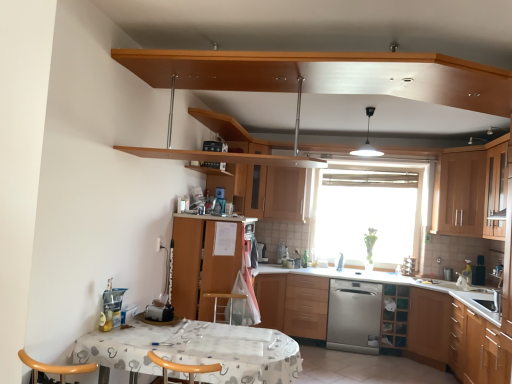
Find the location of a particular element. The height and width of the screenshot is (384, 512). wooden cabinet at center, which appears as the 1th cabinetry when viewed from the left is located at coordinates (x=202, y=264).

Describe the element at coordinates (495, 191) in the screenshot. The width and height of the screenshot is (512, 384). I see `wooden cabinet at upper right, the 1th cabinetry positioned from the right` at that location.

Measure the distance between wooden cabinet at upper right, which is counted as the 6th cabinetry, starting from the left, and camera.

wooden cabinet at upper right, which is counted as the 6th cabinetry, starting from the left, and camera are 4.13 meters apart from each other.

Describe the element at coordinates (354, 316) in the screenshot. Image resolution: width=512 pixels, height=384 pixels. I see `satin silver dishwasher at center` at that location.

What is the approximate height of transparent glass window at center?

4.64 feet.

This screenshot has height=384, width=512. In order to click on white fabric-covered table at lower center in this screenshot , I will do `click(197, 350)`.

This screenshot has height=384, width=512. What do you see at coordinates (275, 192) in the screenshot? I see `wooden cabinet at center, the 5th cabinetry in the right-to-left sequence` at bounding box center [275, 192].

The height and width of the screenshot is (384, 512). In order to click on wooden cabinet at center, which appears as the 1th cabinetry when viewed from the left in this screenshot , I will do `click(202, 264)`.

From a real-world perspective, which is physically below, wooden cabinet at right, the 5th cabinetry from the left, or satin silver dishwasher at center?

satin silver dishwasher at center.

Considering their positions, is wooden cabinet at right, the 5th cabinetry from the left, located in front of or behind satin silver dishwasher at center?

wooden cabinet at right, the 5th cabinetry from the left, is positioned closer to the viewer than satin silver dishwasher at center.

Are wooden cabinet at right, which ranks as the second cabinetry in right-to-left order, and satin silver dishwasher at center located far from each other?

wooden cabinet at right, which ranks as the second cabinetry in right-to-left order, is far away from satin silver dishwasher at center.

At what (x,y) coordinates should I click in order to perform the action: click on table that appears in front of the wooden cabinet at upper right, which is counted as the 6th cabinetry, starting from the left. Please return your answer as a coordinate pair (x, y). This screenshot has height=384, width=512. Looking at the image, I should click on (197, 350).

Is white fabric-covered table at lower center taller than wooden cabinet at upper right, the 1th cabinetry positioned from the right?

In fact, white fabric-covered table at lower center may be shorter than wooden cabinet at upper right, the 1th cabinetry positioned from the right.

Which object is positioned more to the right, white fabric-covered table at lower center or wooden cabinet at upper right, the 1th cabinetry positioned from the right?

From the viewer's perspective, wooden cabinet at upper right, the 1th cabinetry positioned from the right, appears more on the right side.

Is white fabric-covered table at lower center further to camera compared to wooden cabinet at upper right, which is counted as the 6th cabinetry, starting from the left?

No, it is not.

Is wooden cabinet at upper right, the 1th cabinetry positioned from the right, next to wooden cabinet at right, the 4th cabinetry positioned from the left?

wooden cabinet at upper right, the 1th cabinetry positioned from the right, and wooden cabinet at right, the 4th cabinetry positioned from the left, are not in contact.

Is wooden cabinet at upper right, the 1th cabinetry positioned from the right, situated inside wooden cabinet at right, arranged as the 3th cabinetry when viewed from the right, or outside?

wooden cabinet at upper right, the 1th cabinetry positioned from the right, cannot be found inside wooden cabinet at right, arranged as the 3th cabinetry when viewed from the right.

Based on the photo, which object is positioned more to the left, wooden cabinet at upper right, which is counted as the 6th cabinetry, starting from the left, or wooden cabinet at right, the 4th cabinetry positioned from the left?

wooden cabinet at right, the 4th cabinetry positioned from the left, is more to the left.

Choose the correct answer: Is wooden cabinet at right, the 4th cabinetry positioned from the left, inside wooden cabinet at center, which appears as the 1th cabinetry when viewed from the left, or outside it?

wooden cabinet at right, the 4th cabinetry positioned from the left, is not enclosed by wooden cabinet at center, which appears as the 1th cabinetry when viewed from the left.

How many degrees apart are the facing directions of wooden cabinet at right, arranged as the 3th cabinetry when viewed from the right, and wooden cabinet at center, arranged as the 6th cabinetry when viewed from the right?

They differ by 180 degrees in their facing directions.

Between wooden cabinet at right, arranged as the 3th cabinetry when viewed from the right, and wooden cabinet at center, which appears as the 1th cabinetry when viewed from the left, which one has larger width?

With larger width is wooden cabinet at center, which appears as the 1th cabinetry when viewed from the left.

Which is more to the left, wooden cabinet at right, the 4th cabinetry positioned from the left, or wooden cabinet at center, which appears as the 1th cabinetry when viewed from the left?

wooden cabinet at center, which appears as the 1th cabinetry when viewed from the left.

Does point (277, 370) lie in front of point (453, 347)?

Yes, it is.

Based on their sizes in the image, would you say white fabric-covered table at lower center is bigger or smaller than wooden cabinet at right, arranged as the 3th cabinetry when viewed from the right?

white fabric-covered table at lower center is smaller than wooden cabinet at right, arranged as the 3th cabinetry when viewed from the right.

From the image's perspective, between white fabric-covered table at lower center and wooden cabinet at right, arranged as the 3th cabinetry when viewed from the right, who is located below?

wooden cabinet at right, arranged as the 3th cabinetry when viewed from the right, is shown below in the image.

Considering the positions of objects wooden cabinet at upper center, which is counted as the 2th shelf, starting from the bottom, and wooden shelf at lower right, the 1th shelf when ordered from back to front, in the image provided, who is more to the left, wooden cabinet at upper center, which is counted as the 2th shelf, starting from the bottom, or wooden shelf at lower right, the 1th shelf when ordered from back to front,?

Positioned to the left is wooden cabinet at upper center, which is counted as the 2th shelf, starting from the bottom.

Does wooden cabinet at upper center, the 2th shelf positioned from the right, turn towards wooden shelf at lower right, the 1th shelf viewed from the right?

No, wooden cabinet at upper center, the 2th shelf positioned from the right, is not aimed at wooden shelf at lower right, the 1th shelf viewed from the right.

Does point (188, 165) appear closer or farther from the camera than point (398, 343)?

Point (188, 165).

Are wooden cabinet at upper center, the 2th shelf positioned from the right, and wooden shelf at lower right, acting as the 1th shelf starting from the bottom, beside each other?

wooden cabinet at upper center, the 2th shelf positioned from the right, and wooden shelf at lower right, acting as the 1th shelf starting from the bottom, are clearly separated.

Does point (352, 252) come farther from viewer compared to point (488, 365)?

Yes.

Is transparent glass window at center looking in the opposite direction of wooden cabinet at right, arranged as the 3th cabinetry when viewed from the right?

No, wooden cabinet at right, arranged as the 3th cabinetry when viewed from the right, is not at the back of transparent glass window at center.

Considering their positions, is transparent glass window at center located in front of or behind wooden cabinet at right, arranged as the 3th cabinetry when viewed from the right?

Clearly, transparent glass window at center is behind wooden cabinet at right, arranged as the 3th cabinetry when viewed from the right.

Can you confirm if transparent glass window at center is shorter than wooden cabinet at right, the 4th cabinetry positioned from the left?

No, transparent glass window at center is not shorter than wooden cabinet at right, the 4th cabinetry positioned from the left.

The height and width of the screenshot is (384, 512). I want to click on kitchen appliance that appears on the left of wooden cabinet at right, which ranks as the second cabinetry in right-to-left order, so click(x=354, y=316).

You are a GUI agent. You are given a task and a screenshot of the screen. Output one action in this format:
    pyautogui.click(x=<x>, y=<y>)
    Task: Click on the 4th cabinetry positioned above the white fabric-covered table at lower center (from a real-world perspective)
    This screenshot has width=512, height=384.
    Given the screenshot: What is the action you would take?
    pyautogui.click(x=495, y=191)

Considering their positions, is wooden cabinet at right, the 4th cabinetry positioned from the left, positioned closer to transparent glass window at center than wooden cabinet at upper center, which is the 1th shelf from top to bottom?

wooden cabinet at right, the 4th cabinetry positioned from the left.

When comparing their distances from wooden cabinet at lower center, placed as the 4th cabinetry when sorted from right to left, does wooden cabinet at upper center, the 1th shelf positioned from the left, or wooden cabinet at center, the 2th cabinetry in the left-to-right sequence, seem further?

Among the two, wooden cabinet at upper center, the 1th shelf positioned from the left, is located further to wooden cabinet at lower center, placed as the 4th cabinetry when sorted from right to left.

Which object lies further to the anchor point wooden cabinet at center, arranged as the 6th cabinetry when viewed from the right, satin silver dishwasher at center or wooden cabinet at upper right, which is counted as the 6th cabinetry, starting from the left?

Based on the image, wooden cabinet at upper right, which is counted as the 6th cabinetry, starting from the left, appears to be further to wooden cabinet at center, arranged as the 6th cabinetry when viewed from the right.

When comparing their distances from wooden cabinet at center, arranged as the 6th cabinetry when viewed from the right, does wooden shelf at lower right, placed as the second shelf when sorted from front to back, or wooden cabinet at upper center, which appears as the second shelf when viewed from the back, seem closer?

wooden cabinet at upper center, which appears as the second shelf when viewed from the back, is positioned closer to the anchor wooden cabinet at center, arranged as the 6th cabinetry when viewed from the right.

Estimate the real-world distances between objects in this image. Which object is closer to wooden shelf at lower right, marked as the second shelf in a left-to-right arrangement, wooden cabinet at upper center, which is the first shelf in front-to-back order, or wooden cabinet at right, which ranks as the second cabinetry in right-to-left order?

wooden cabinet at right, which ranks as the second cabinetry in right-to-left order, is positioned closer to the anchor wooden shelf at lower right, marked as the second shelf in a left-to-right arrangement.

Which object lies further to the anchor point wooden cabinet at right, the 5th cabinetry from the left, wooden cabinet at right, arranged as the 3th cabinetry when viewed from the right, or wooden cabinet at center, arranged as the 6th cabinetry when viewed from the right?

wooden cabinet at center, arranged as the 6th cabinetry when viewed from the right.

Considering their positions, is white fabric-covered table at lower center positioned further to transparent glass window at center than wooden cabinet at upper center, which is counted as the 2th shelf, starting from the bottom?

white fabric-covered table at lower center is positioned further to the anchor transparent glass window at center.

Which object lies nearer to the anchor point wooden cabinet at center, which appears as the 1th cabinetry when viewed from the left, wooden cabinet at lower center, acting as the 3th cabinetry starting from the left, or wooden cabinet at right, arranged as the 3th cabinetry when viewed from the right?

Among the two, wooden cabinet at lower center, acting as the 3th cabinetry starting from the left, is located nearer to wooden cabinet at center, which appears as the 1th cabinetry when viewed from the left.

The width and height of the screenshot is (512, 384). Find the location of `shelf between wooden cabinet at upper center, which is the first shelf in front-to-back order, and wooden cabinet at upper right, the 1th cabinetry positioned from the right, in the horizontal direction`. shelf between wooden cabinet at upper center, which is the first shelf in front-to-back order, and wooden cabinet at upper right, the 1th cabinetry positioned from the right, in the horizontal direction is located at coordinates (394, 316).

Image resolution: width=512 pixels, height=384 pixels. Find the location of `kitchen appliance located between wooden cabinet at right, arranged as the 3th cabinetry when viewed from the right, and wooden cabinet at center, the 5th cabinetry in the right-to-left sequence, in the depth direction`. kitchen appliance located between wooden cabinet at right, arranged as the 3th cabinetry when viewed from the right, and wooden cabinet at center, the 5th cabinetry in the right-to-left sequence, in the depth direction is located at coordinates (354, 316).

Identify the location of table situated between wooden cabinet at upper center, which is the 1th shelf from top to bottom, and wooden cabinet at upper right, the 1th cabinetry positioned from the right, from left to right. This screenshot has height=384, width=512. (197, 350).

Where is `window between wooden cabinet at center, the 5th cabinetry in the right-to-left sequence, and wooden shelf at lower right, marked as the second shelf in a left-to-right arrangement, in the vertical direction`? window between wooden cabinet at center, the 5th cabinetry in the right-to-left sequence, and wooden shelf at lower right, marked as the second shelf in a left-to-right arrangement, in the vertical direction is located at coordinates (369, 213).